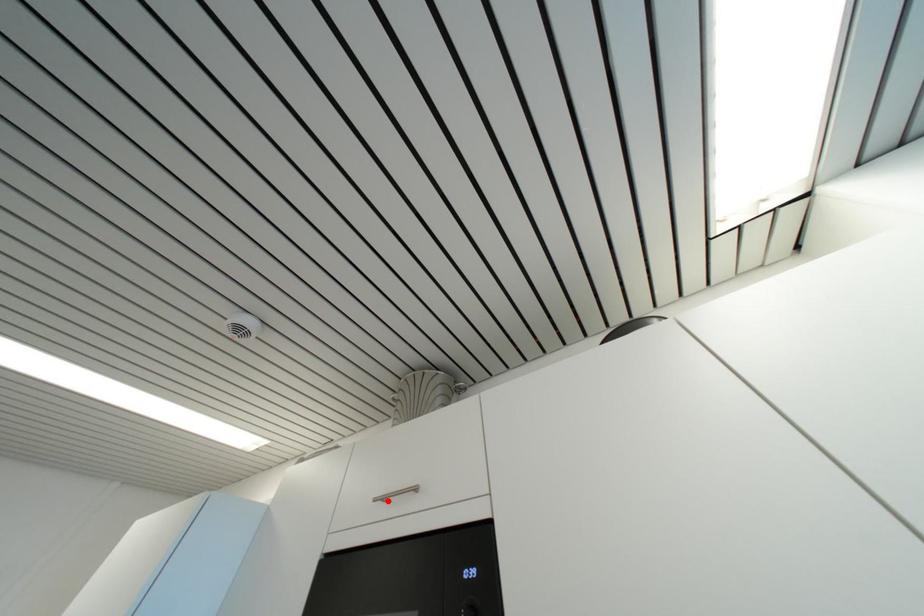
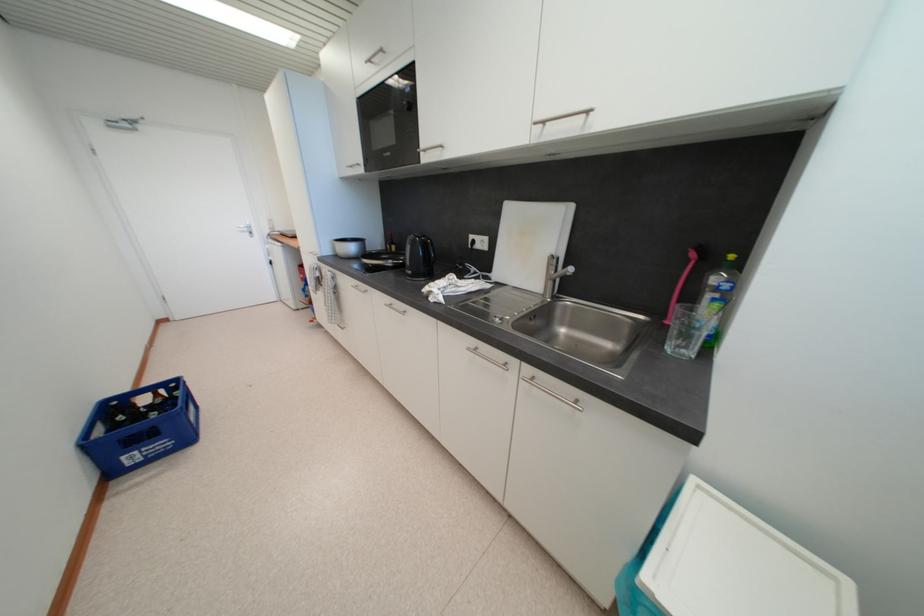
Find the pixel in the second image that matches the highlighted location in the first image.

(375, 63)